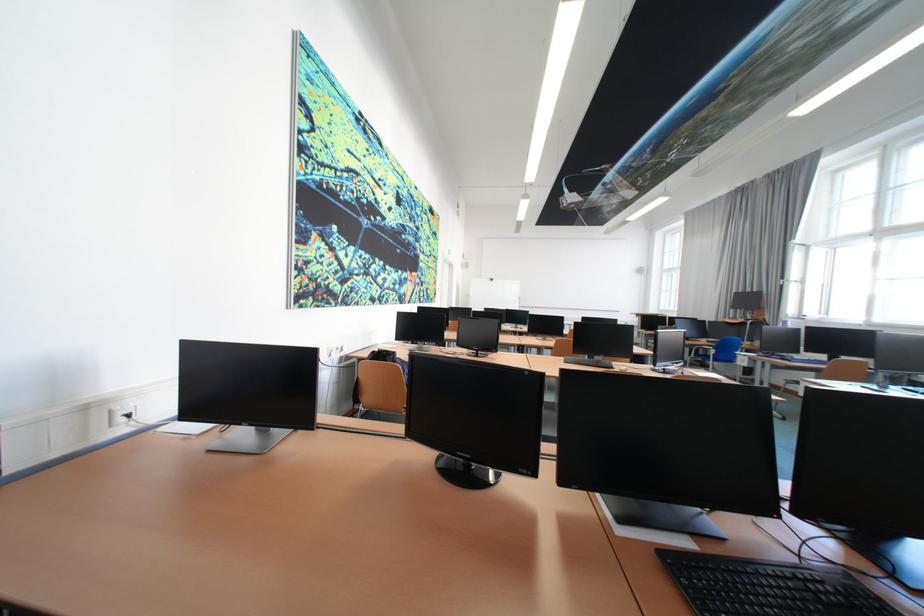
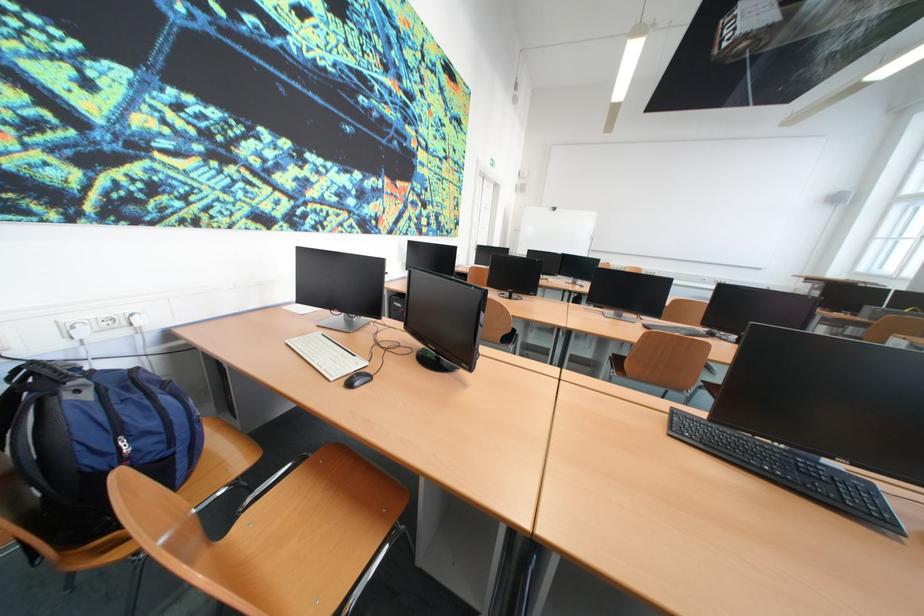
Question: The images are taken continuously from a first-person perspective. In which direction are you moving?

Choices:
 (A) Left
 (B) Right
 (C) Forward
 (D) Backward

Answer: (C)